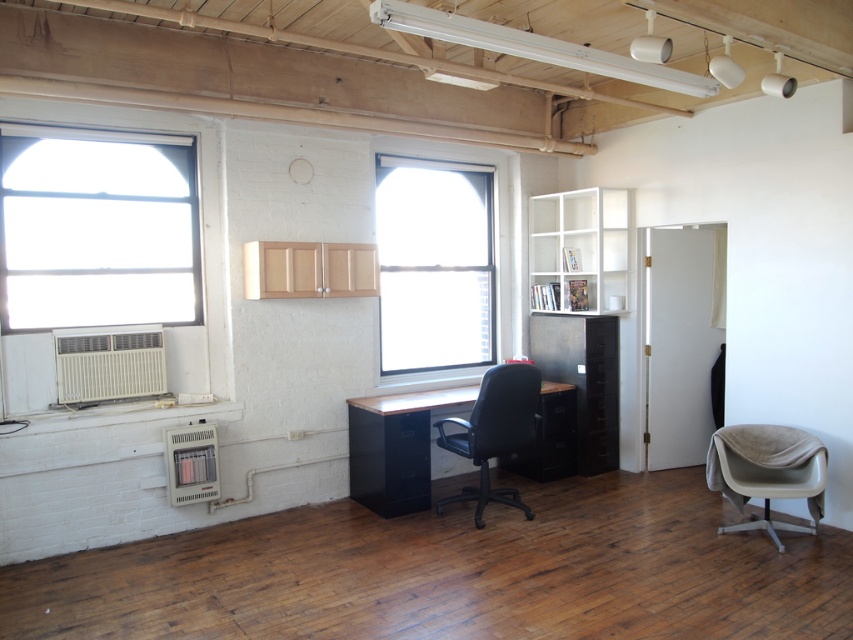
Looking at this image, you are planning to place a new bookshelf in the office. The bookshelf is as wide as the clear glass window at center. Will it fit in the space where the matte wood desk at center is currently located?

The clear glass window at center is narrower than the matte wood desk at center. Since the bookshelf is as wide as the window, it will fit in the space where the desk is located because the desk is wider than the window.

You are standing at the entrance of the office and want to sit down in the beige fabric swivel chair at lower right. Based on the coordinates provided, in which general direction should you move from the entrance to reach the chair?

The beige fabric swivel chair at lower right is located at coordinates point (767, 472), so you should move towards the lower right direction from the entrance to reach it.

You are standing in the office and want to place a new plant on the desk closest to you. Which desk should you choose between the clear glass window at center and the matte wood desk at center?

The matte wood desk at center is closer to you because the clear glass window at center is further away. Place the plant on the matte wood desk at center.